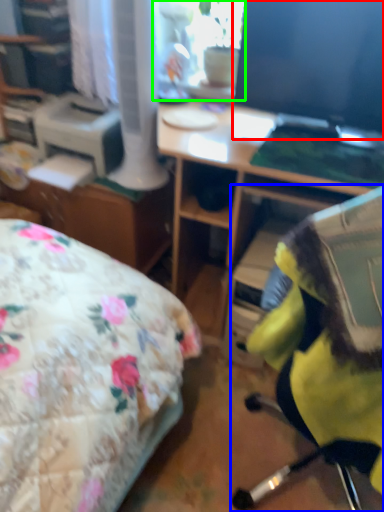
Question: Which is nearer to the computer monitor (highlighted by a red box)? chair (highlighted by a blue box) or window screen (highlighted by a green box).

Choices:
 (A) chair
 (B) window screen

Answer: (B)